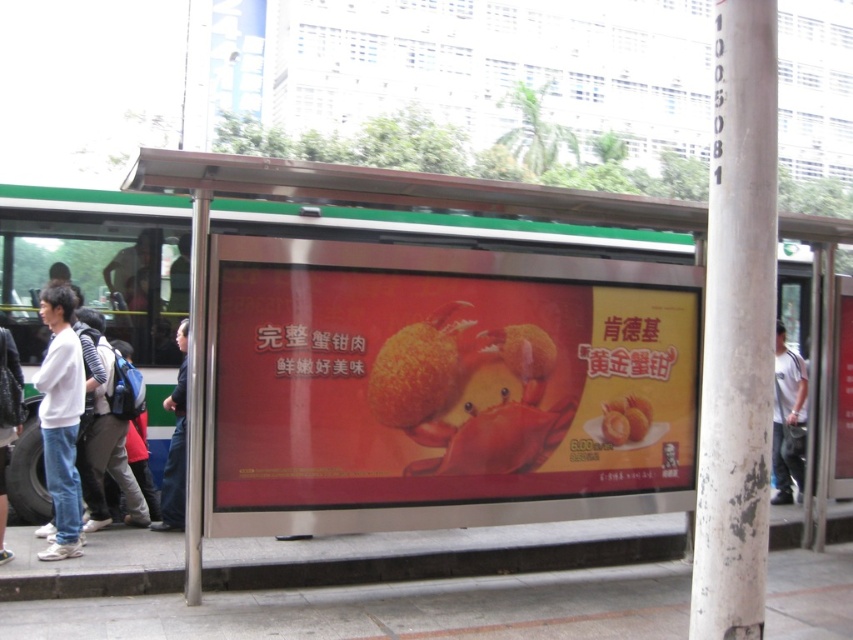
Does red glossy poster at center appear on the left side of blue backpack at left?

No, red glossy poster at center is not to the left of blue backpack at left.

Consider the image. Is red glossy poster at center below blue backpack at left?

Actually, red glossy poster at center is above blue backpack at left.

Measure the distance between point (526, 289) and camera.

They are 5.77 meters apart.

At what (x,y) coordinates should I click in order to perform the action: click on red glossy poster at center. Please return your answer as a coordinate pair (x, y). The image size is (853, 640). Looking at the image, I should click on (445, 388).

Can you confirm if white matte shirt at left is positioned to the right of white cotton shirt at left?

Yes, white matte shirt at left is to the right of white cotton shirt at left.

Which is in front, point (79, 368) or point (7, 429)?

Positioned in front is point (7, 429).

Which is in front, point (61, 346) or point (0, 506)?

Positioned in front is point (0, 506).

This screenshot has width=853, height=640. I want to click on white matte shirt at left, so click(x=61, y=419).

Between red glossy poster at center and white cotton shirt at right, which one has less height?

red glossy poster at center is shorter.

Is red glossy poster at center positioned at the back of white cotton shirt at right?

No, red glossy poster at center is in front of white cotton shirt at right.

Where is `red glossy poster at center`? The width and height of the screenshot is (853, 640). red glossy poster at center is located at coordinates (445, 388).

The image size is (853, 640). I want to click on red glossy poster at center, so click(x=445, y=388).